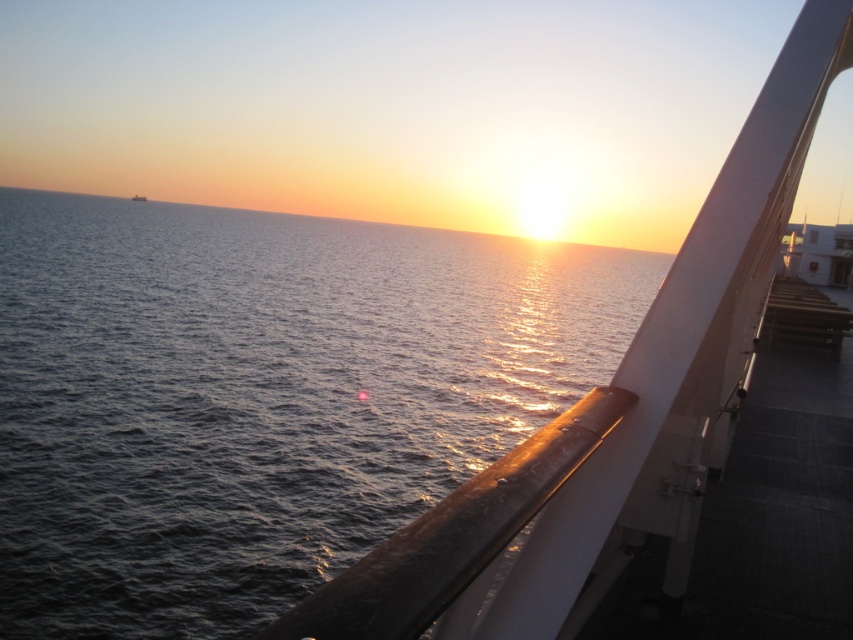
From the picture: You are an observer on the ship deck. You see the dark blue water at center and the smooth white railing at upper right. Which object takes up more space in the image?

The dark blue water at center takes up more space in the image as it has a larger size compared to the smooth white railing at upper right.

You are standing on the ship deck and want to look at the sunset. Which object, the dark blue water at center or the smooth white railing at upper right, will block your view of the horizon?

The dark blue water at center has a greater height compared to the smooth white railing at upper right, so the dark blue water at center will block your view of the horizon.

You are standing on the ship deck and want to take a photo of the sunset. The camera you have can only focus on objects within 30 meters. Is the point at coordinates point (207, 445) within the camera focus range?

The point at coordinates point (207, 445) is 29.04 meters away from the camera, which is within the 30 meters focus range. Therefore, the camera can focus on it.